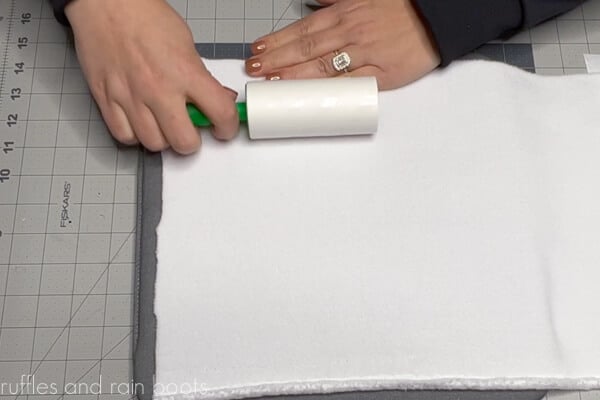
Find the location of a particular element. This screenshot has width=600, height=400. rolling pin is located at coordinates (304, 109).